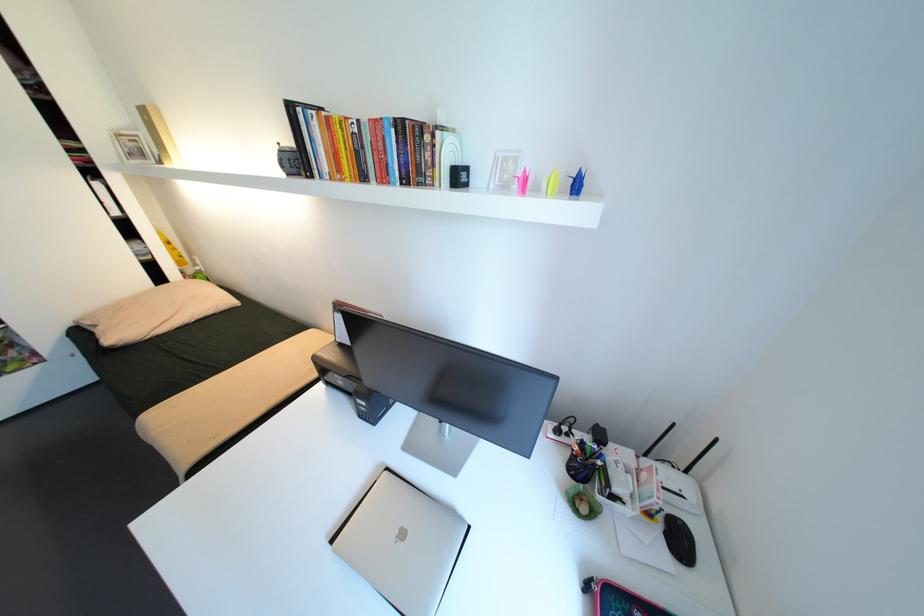
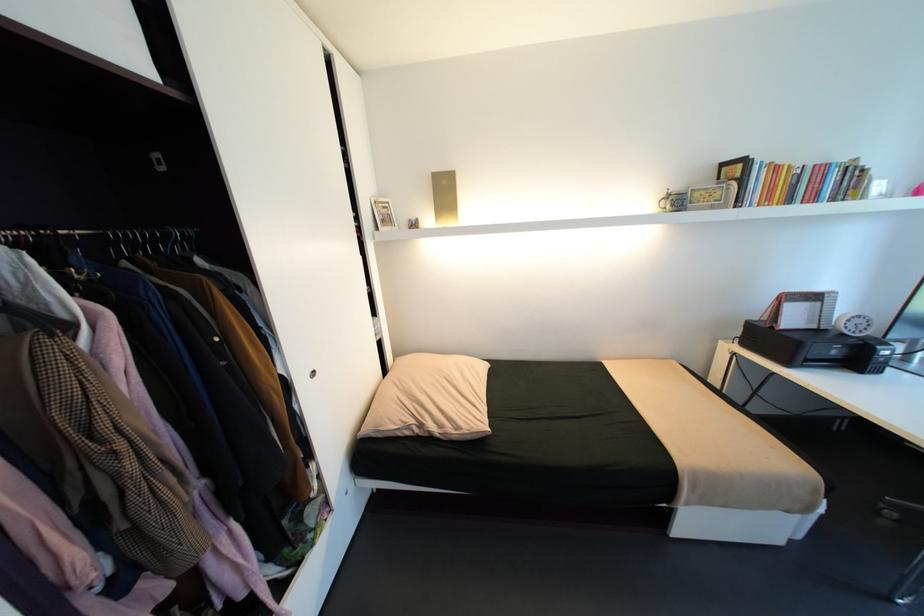
In the second image, find the point that corresponds to pixel 100 330 in the first image.

(415, 432)